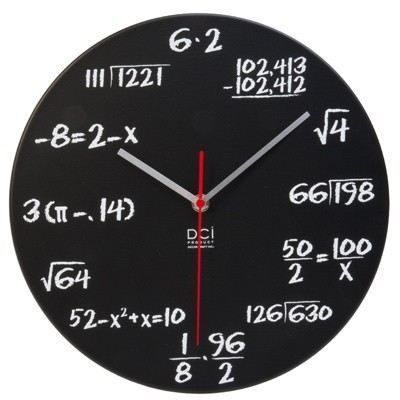
Pinpoint the coordinates of what holds the hands on the clock in the image. Your answer should be formatted as a list of tuples, i.e. [(x1, y1), (x2, y2), ...], where each tuple contains the x and y coordinates of a point satisfying the conditions above.

[(199, 203)]